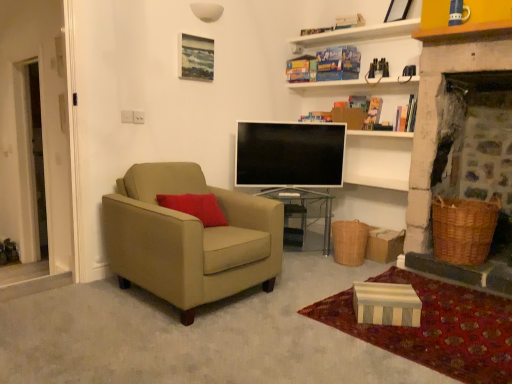
Image resolution: width=512 pixels, height=384 pixels. In order to click on free spot to the right of suede beige armchair at left in this screenshot , I will do `click(304, 292)`.